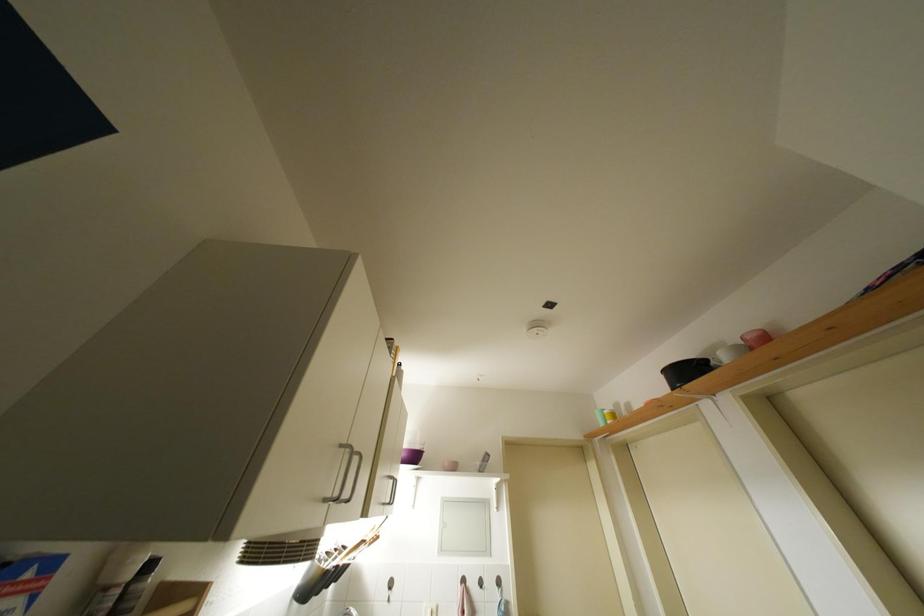
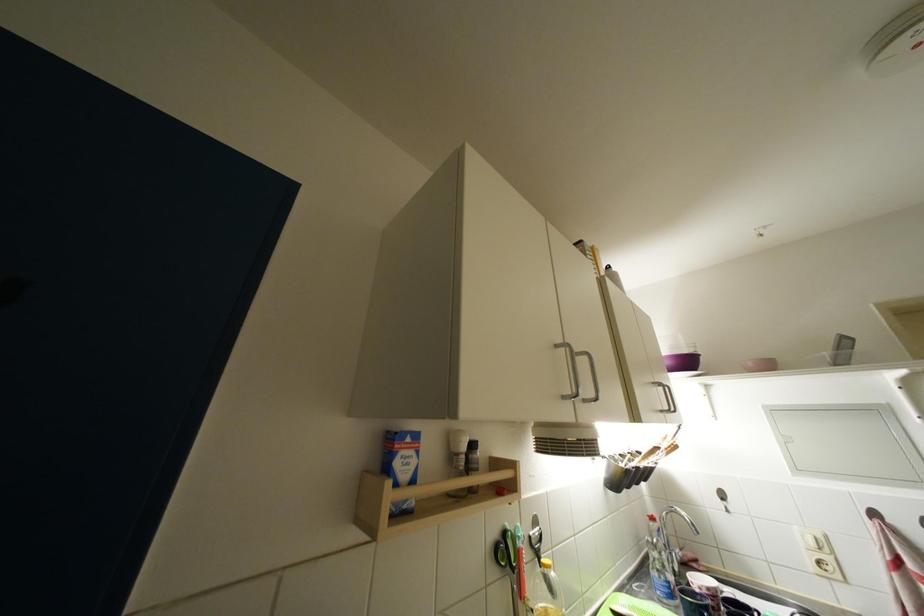
Where in the second image is the point corresponding to the point at 410,459 from the first image?

(675, 367)